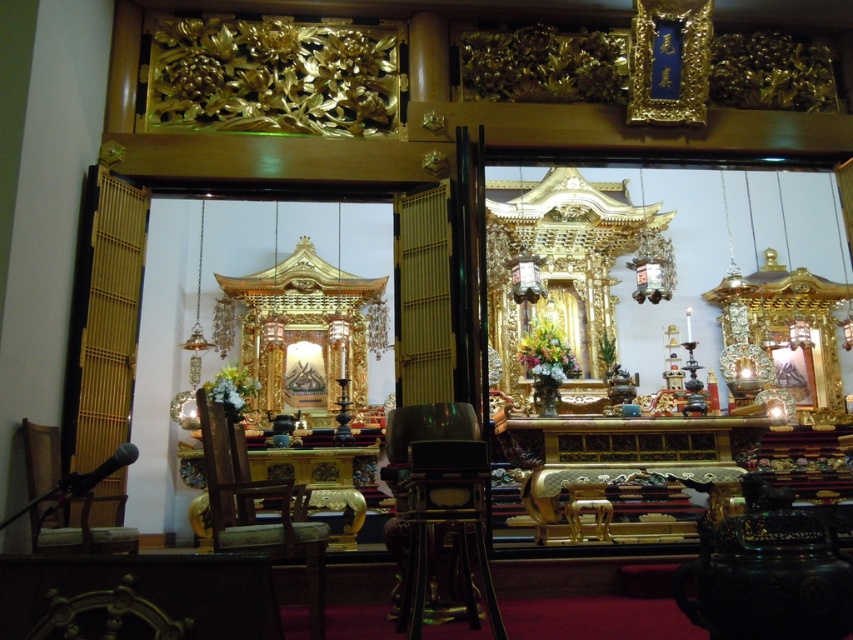
Question: Does metallic gold chair at center appear over wooden chair at center?

Choices:
 (A) no
 (B) yes

Answer: (B)

Question: Is metallic gold chair at center to the right of wooden chair at center from the viewer's perspective?

Choices:
 (A) no
 (B) yes

Answer: (B)

Question: Among these points, which one is farthest from the camera?

Choices:
 (A) (24, 436)
 (B) (107, 604)

Answer: (A)

Question: Which point appears closest to the camera in this image?

Choices:
 (A) (242, 465)
 (B) (462, 406)
 (C) (131, 592)
 (D) (47, 428)

Answer: (C)

Question: Based on their relative distances, which object is nearer to the metallic gold chair at center?

Choices:
 (A) wooden chair at lower left
 (B) wooden chair at center

Answer: (B)

Question: Is wooden chair at lower left to the left of polished wood chair at lower left from the viewer's perspective?

Choices:
 (A) no
 (B) yes

Answer: (B)